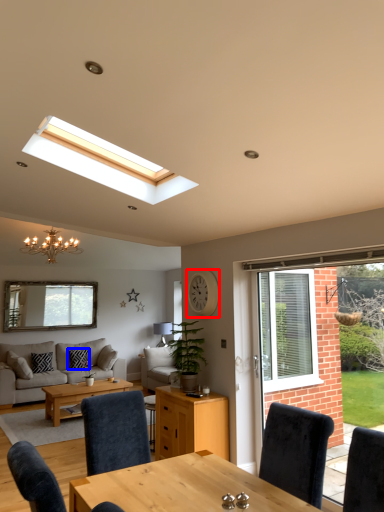
Question: Which of the following is the farthest to the observer, clock (highlighted by a red box) or pillow (highlighted by a blue box)?

Choices:
 (A) clock
 (B) pillow

Answer: (B)